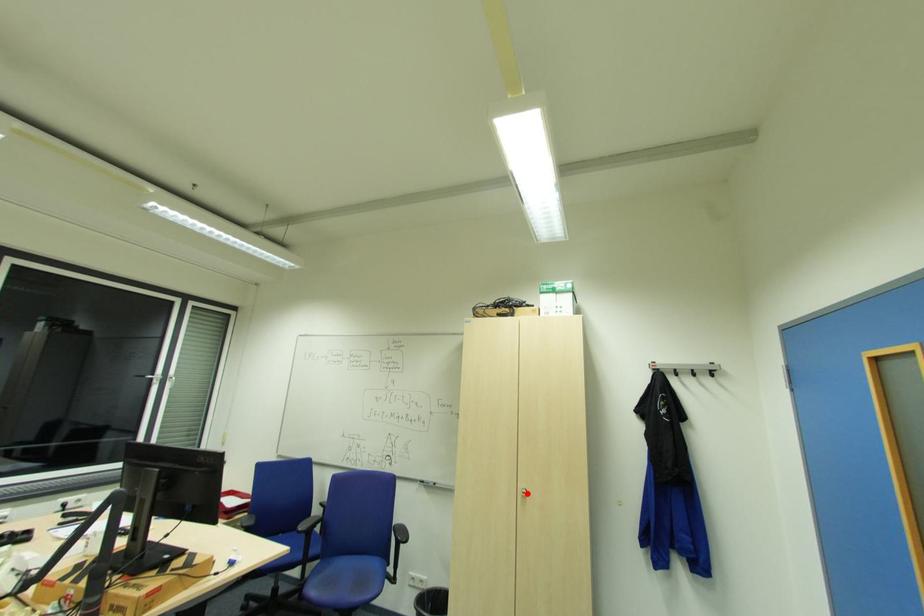
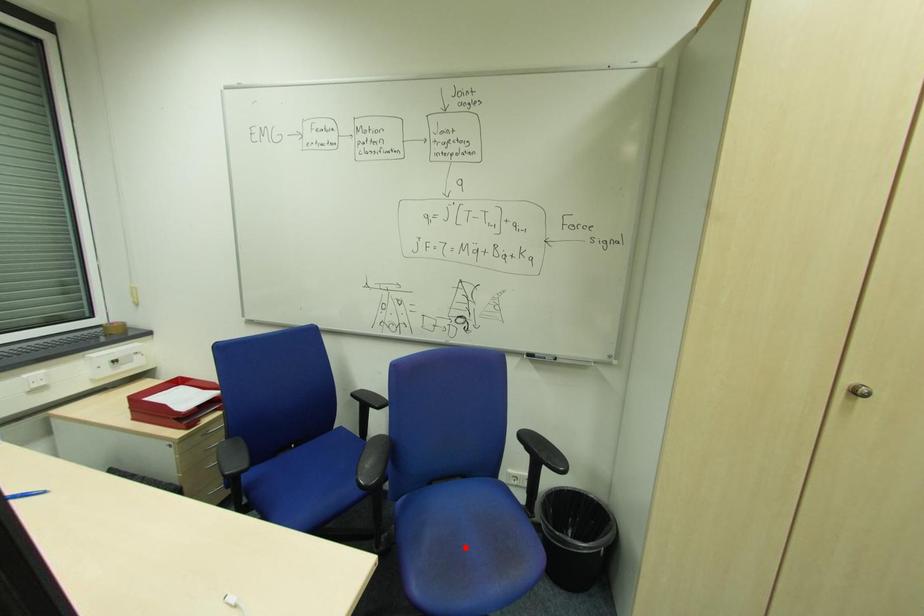
From the picture: I am providing you with two images of the same scene from different viewpoints. A red point is marked on the first image and another point is marked on the second image. Is the red point in image1 aligned with the point shown in image2?

No